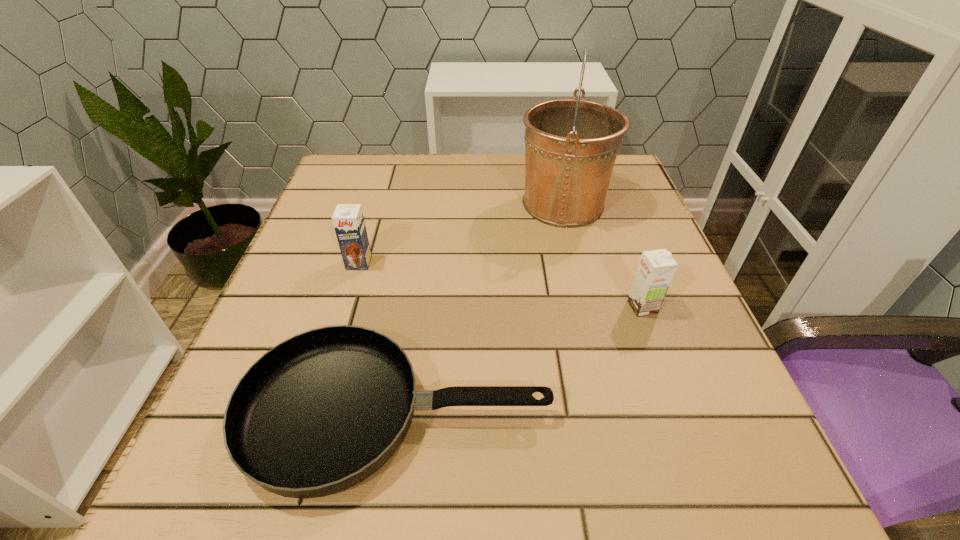
Find the location of a particular element. The image size is (960, 540). unoccupied area between the farther chocolate milk and the right chocolate milk is located at coordinates (501, 285).

The height and width of the screenshot is (540, 960). What are the coordinates of `free point between the shortest object and the third farthest object` in the screenshot? It's located at (519, 361).

Locate an element on the screen. This screenshot has width=960, height=540. unoccupied position between the right chocolate milk and the tallest object is located at coordinates (603, 256).

Where is `vacant region between the right chocolate milk and the tallest object`? This screenshot has width=960, height=540. vacant region between the right chocolate milk and the tallest object is located at coordinates (603, 256).

Image resolution: width=960 pixels, height=540 pixels. What are the coordinates of `object that is the second closest one to the bucket` in the screenshot? It's located at (319, 413).

The image size is (960, 540). I want to click on object that stands as the closest to the second nearest object, so (319, 413).

I want to click on vacant area in the image that satisfies the following two spatial constraints: 1. on the front label of the right chocolate milk; 2. on the right side of the farther chocolate milk, so click(346, 307).

The height and width of the screenshot is (540, 960). In order to click on vacant region that satisfies the following two spatial constraints: 1. on the front side of the bucket; 2. at the end of the handle of the frying pan in this screenshot , I will do `click(615, 414)`.

I want to click on vacant region that satisfies the following two spatial constraints: 1. on the front label of the right chocolate milk; 2. on the left side of the second farthest object, so click(x=346, y=307).